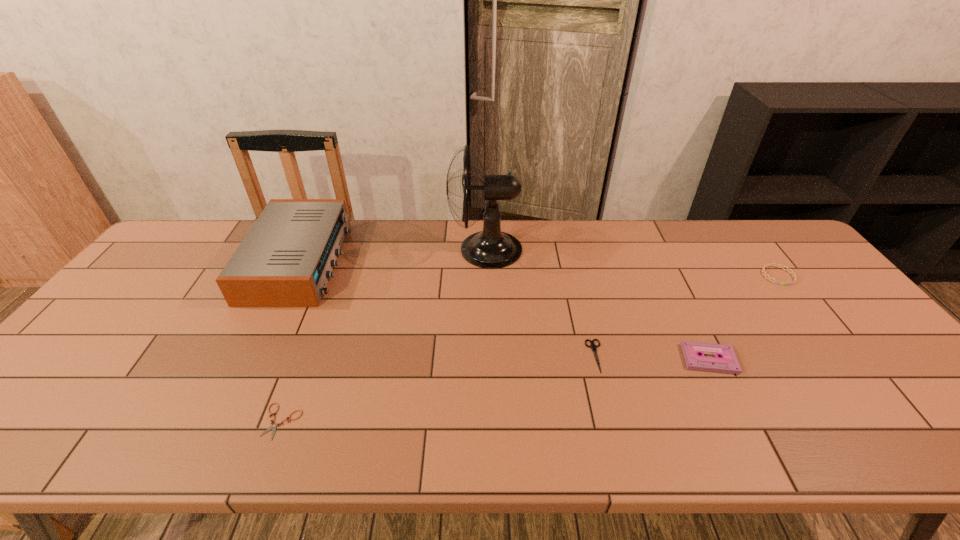
The width and height of the screenshot is (960, 540). In order to click on fan in this screenshot , I will do [491, 248].

You are a GUI agent. You are given a task and a screenshot of the screen. Output one action in this format:
    pyautogui.click(x=<x>, y=<y>)
    Task: Click on the tallest object
    The image size is (960, 540).
    Given the screenshot: What is the action you would take?
    pyautogui.click(x=491, y=248)

This screenshot has width=960, height=540. I want to click on the second tallest object, so tap(285, 260).

Where is `the rightmost object`? the rightmost object is located at coordinates (782, 267).

Locate an element on the screen. The image size is (960, 540). videotape is located at coordinates (693, 352).

The image size is (960, 540). In order to click on the taller shears in this screenshot , I will do `click(592, 346)`.

The width and height of the screenshot is (960, 540). What are the coordinates of `the farther shears` in the screenshot? It's located at (592, 346).

Locate an element on the screen. The image size is (960, 540). the shortest object is located at coordinates (274, 426).

Locate an element on the screen. This screenshot has width=960, height=540. the nearer shears is located at coordinates (274, 426).

The height and width of the screenshot is (540, 960). I want to click on free location located 0.200m on the front-facing side of the tallest object, so click(x=388, y=249).